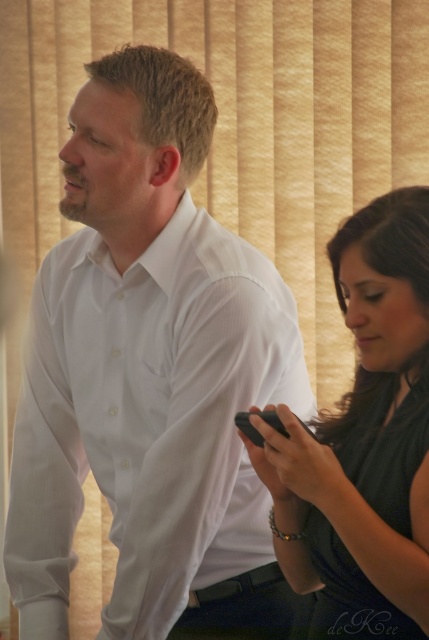
You are a photographer setting up a shoot in the room. You need to ensure that the white smooth shirt at center is visible in the frame without being blocked by the black matte phone at right. Based on their positions, will the phone block the shirt?

The white smooth shirt at center is above the black matte phone at right, so the phone will not block the shirt in the frame.

You are a tailor who needs to determine if the white smooth shirt at center can be folded and placed inside the black matte phone at right. Based on their sizes, what would you advise?

The white smooth shirt at center is bigger than the black matte phone at right, so it cannot be folded and placed inside the black matte phone at right.

You are a delivery robot that needs to place a small package between the white smooth shirt at center and the black matte phone at right. The package is 12 inches long. Will it fit in the space between them?

The white smooth shirt at center and black matte phone at right are 12.01 inches apart. The package is 12 inches long, so it will fit in the space between them since the distance is slightly more than the package length.